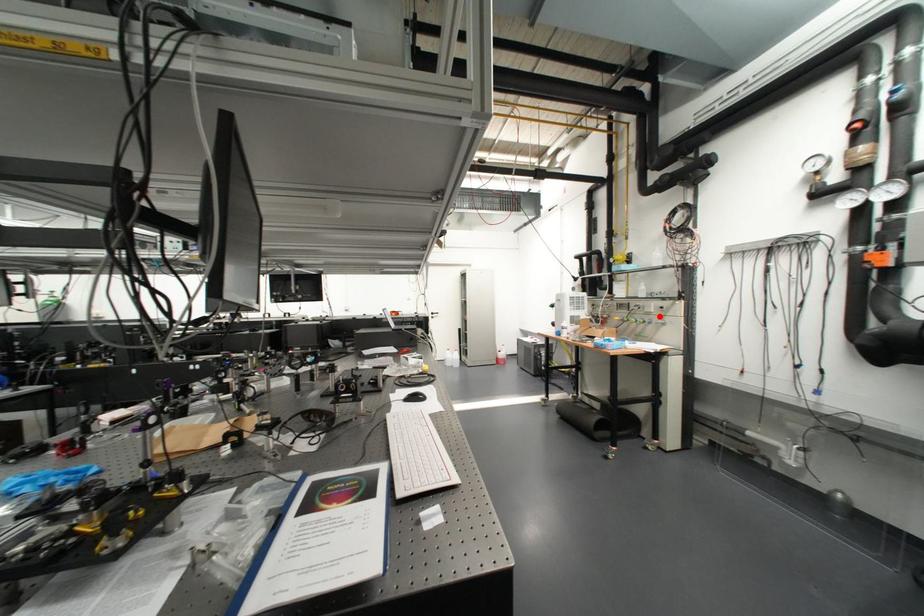
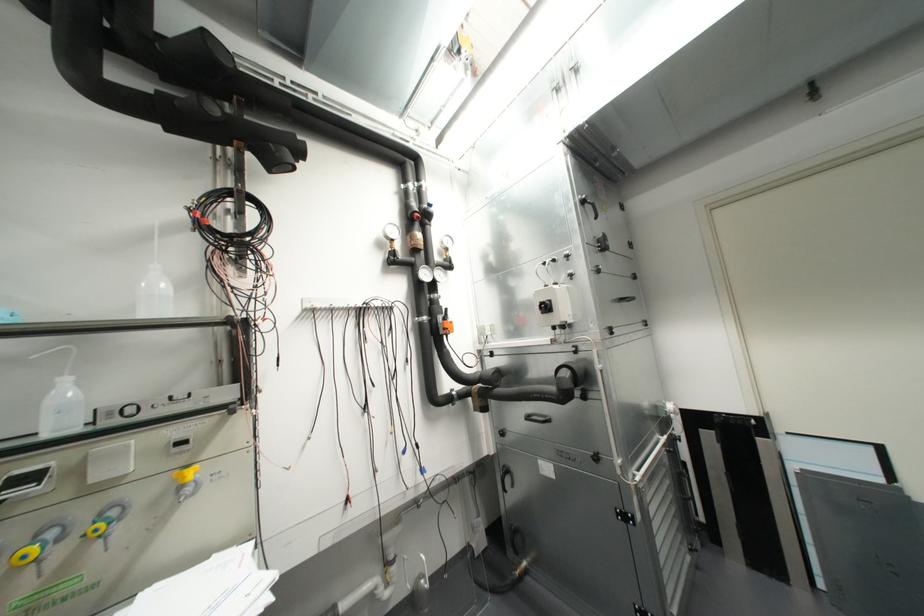
Question: I am providing you with two images of the same scene from different viewpoints. A red point is marked on the first image. At the location where the point appears in image 1, is it still visible in image 2?

Choices:
 (A) Yes
 (B) No

Answer: (B)